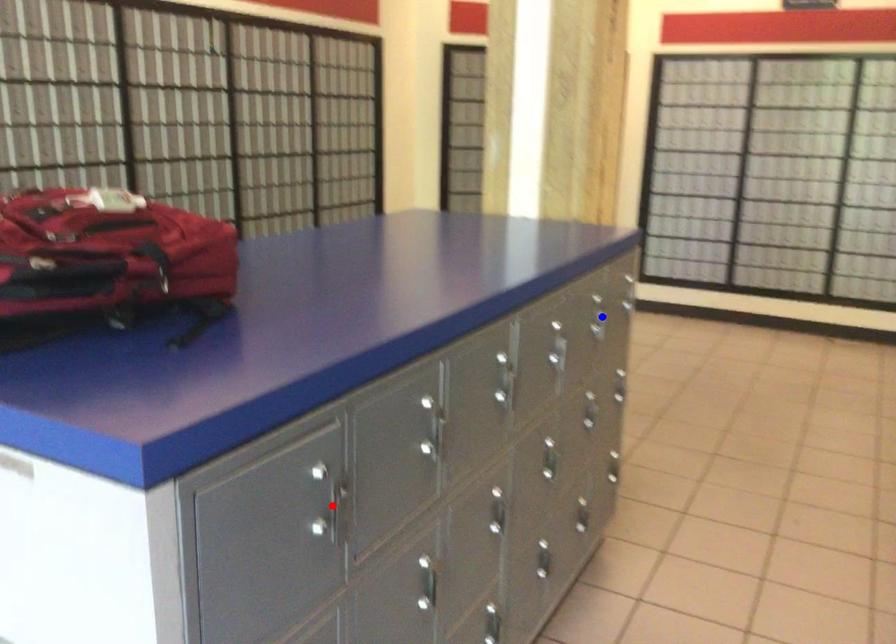
Question: Which of the two points in the image is closer to the camera?

Choices:
 (A) Blue point is closer.
 (B) Red point is closer.

Answer: (B)